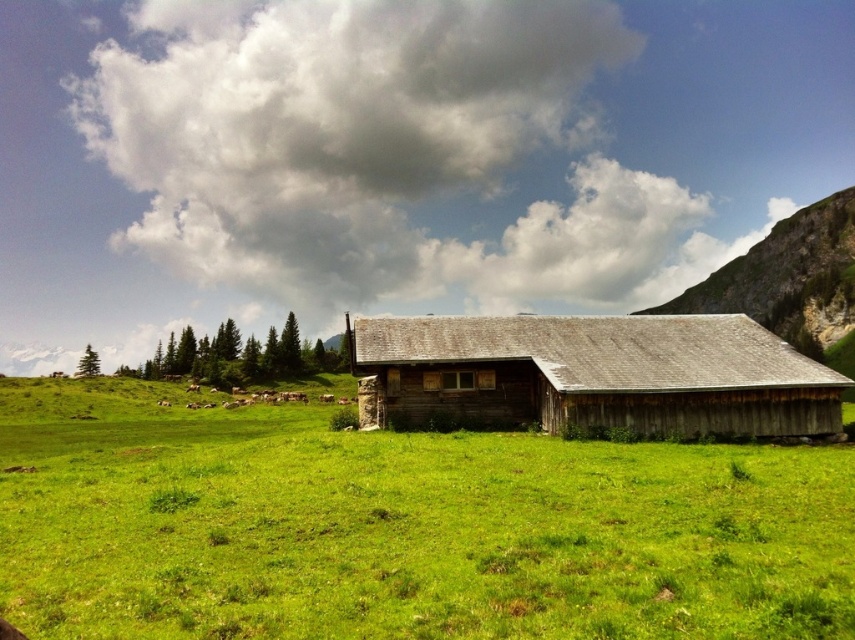
Between cloudy sky at upper center and white woolly cows at lower left, which one is positioned higher?

cloudy sky at upper center is higher up.

Who is more forward, (x=110, y=90) or (x=282, y=401)?

Point (x=282, y=401)

Identify the location of cloudy sky at upper center. click(x=360, y=145).

Can you confirm if cloudy sky at upper center is positioned to the right of weathered wood barn at center?

In fact, cloudy sky at upper center is to the left of weathered wood barn at center.

Is point (429, 179) in front of point (605, 360)?

No, it is not.

The height and width of the screenshot is (640, 855). Identify the location of cloudy sky at upper center. (360, 145).

Which of these two, green grassy field at center or weathered wood barn at center, stands shorter?

Standing shorter between the two is green grassy field at center.

Between green grassy field at center and weathered wood barn at center, which one is positioned lower?

Positioned lower is green grassy field at center.

Between point (66, 420) and point (550, 339), which one is positioned behind?

The point (66, 420) is behind.

Find the location of a particular element. This screenshot has height=640, width=855. green grassy field at center is located at coordinates (401, 528).